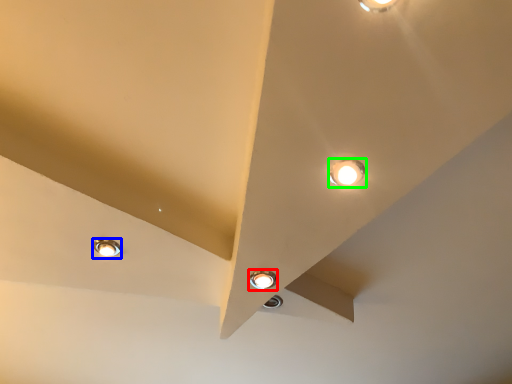
Question: Which object is positioned closest to lamp (highlighted by a red box)? Select from lamp (highlighted by a blue box) and lamp (highlighted by a green box).

Choices:
 (A) lamp
 (B) lamp

Answer: (B)